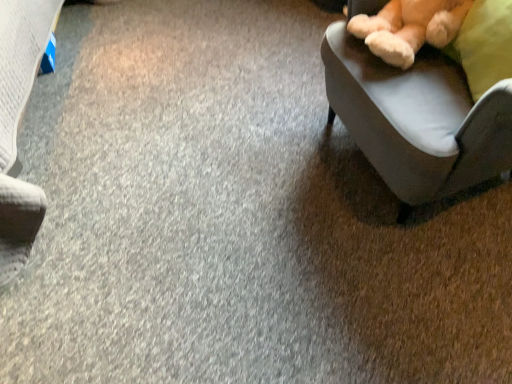
Question: Does soft plush teddy bear at upper right appear on the left side of velvet-like beige chair at right?

Choices:
 (A) no
 (B) yes

Answer: (B)

Question: Considering the relative positions of soft plush teddy bear at upper right and velvet-like beige chair at right in the image provided, is soft plush teddy bear at upper right to the right of velvet-like beige chair at right from the viewer's perspective?

Choices:
 (A) no
 (B) yes

Answer: (A)

Question: Is the surface of soft plush teddy bear at upper right in direct contact with velvet-like beige chair at right?

Choices:
 (A) no
 (B) yes

Answer: (A)

Question: Is soft plush teddy bear at upper right in front of velvet-like beige chair at right?

Choices:
 (A) yes
 (B) no

Answer: (B)

Question: Is there a large distance between soft plush teddy bear at upper right and velvet-like beige chair at right?

Choices:
 (A) yes
 (B) no

Answer: (B)

Question: Does soft plush teddy bear at upper right have a greater height compared to velvet-like beige chair at right?

Choices:
 (A) no
 (B) yes

Answer: (A)

Question: Is velvet-like beige chair at right far away from soft plush teddy bear at upper right?

Choices:
 (A) yes
 (B) no

Answer: (B)

Question: Could you tell me if velvet-like beige chair at right is facing soft plush teddy bear at upper right?

Choices:
 (A) no
 (B) yes

Answer: (B)

Question: Can you see velvet-like beige chair at right touching soft plush teddy bear at upper right?

Choices:
 (A) yes
 (B) no

Answer: (B)

Question: From the image's perspective, does velvet-like beige chair at right appear higher than soft plush teddy bear at upper right?

Choices:
 (A) no
 (B) yes

Answer: (A)

Question: Considering the relative positions of velvet-like beige chair at right and soft plush teddy bear at upper right in the image provided, is velvet-like beige chair at right to the left of soft plush teddy bear at upper right from the viewer's perspective?

Choices:
 (A) yes
 (B) no

Answer: (B)

Question: Is velvet-like beige chair at right bigger than soft plush teddy bear at upper right?

Choices:
 (A) no
 (B) yes

Answer: (B)

Question: Considering the positions of soft plush teddy bear at upper right and velvet-like beige chair at right in the image, is soft plush teddy bear at upper right taller or shorter than velvet-like beige chair at right?

Choices:
 (A) tall
 (B) short

Answer: (B)